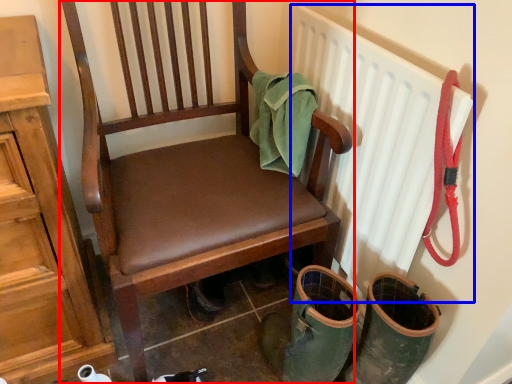
Question: Which point is closer to the camera, chair (highlighted by a red box) or radiator (highlighted by a blue box)?

Choices:
 (A) chair
 (B) radiator

Answer: (A)